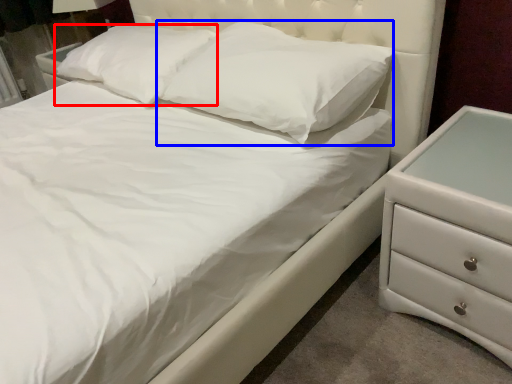
Question: Among these objects, which one is farthest to the camera, pillow (highlighted by a red box) or pillow (highlighted by a blue box)?

Choices:
 (A) pillow
 (B) pillow

Answer: (A)